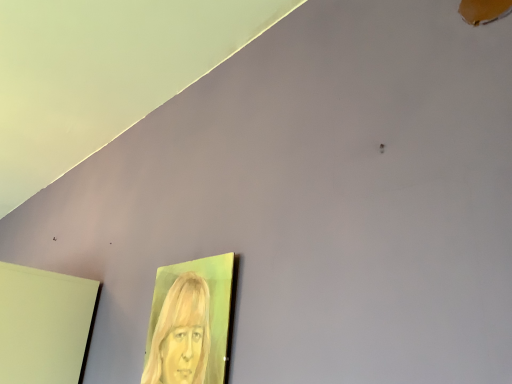
What do you see at coordinates (190, 322) in the screenshot? I see `matte green painting at lower left` at bounding box center [190, 322].

Find the location of a particular element. Image resolution: width=512 pixels, height=384 pixels. matte green painting at lower left is located at coordinates (190, 322).

In order to face matte green painting at lower left, should I rotate leftwards or rightwards?

Rotate your view left by about 9.875°.

Where is `matte green painting at lower left`? matte green painting at lower left is located at coordinates (190, 322).